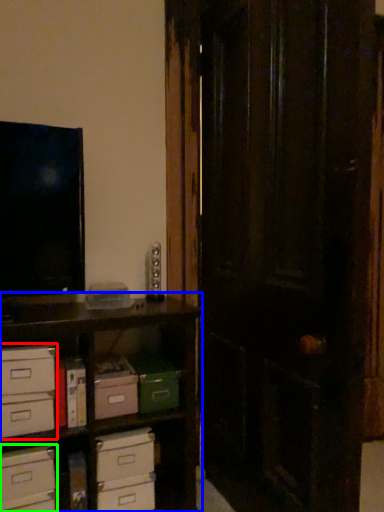
Question: Which object is the closest to the chest of drawers (highlighted by a red box)? Choose among these: shelf (highlighted by a blue box) or drawer (highlighted by a green box).

Choices:
 (A) shelf
 (B) drawer

Answer: (B)